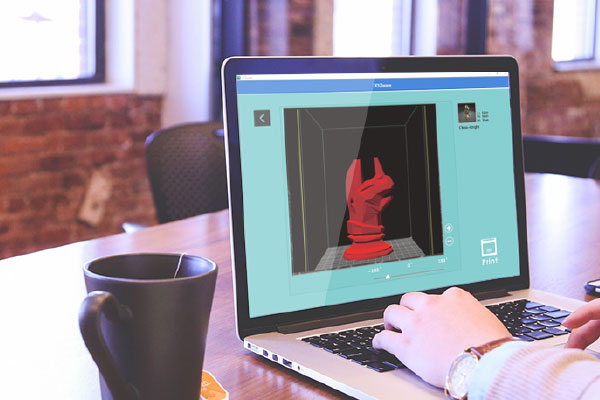
At what (x,y) coordinates should I click in order to perform the action: click on mug handle. Please return your answer as a coordinate pair (x, y). This screenshot has height=400, width=600. Looking at the image, I should click on (83, 321).